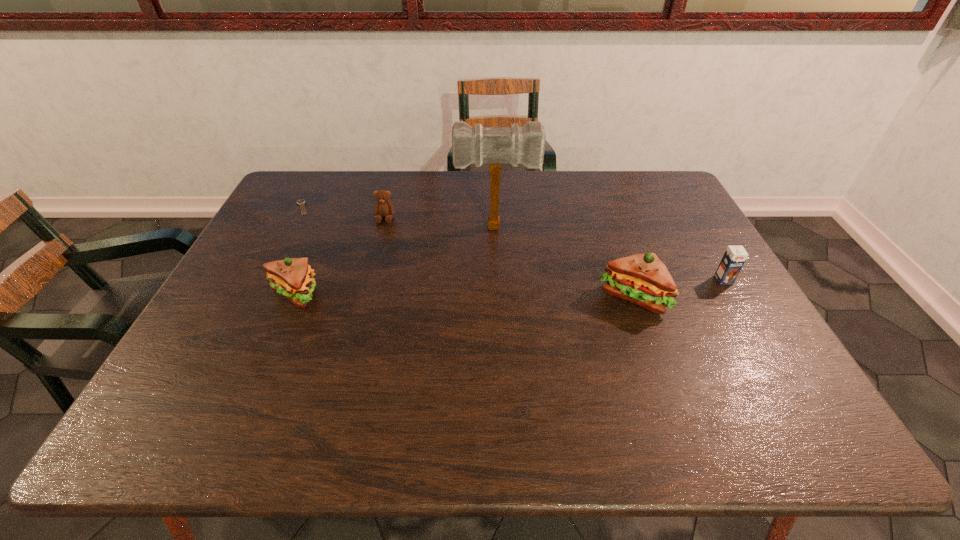
At what (x,y) coordinates should I click in order to perform the action: click on vacant space that is in between the mallet and the fifth shortest object. Please return your answer as a coordinate pair (x, y). Looking at the image, I should click on (564, 262).

Locate an element on the screen. This screenshot has width=960, height=540. empty space that is in between the left sandwich and the shortest object is located at coordinates (299, 251).

At what (x,y) coordinates should I click in order to perform the action: click on vacant area that lies between the taller sandwich and the left sandwich. Please return your answer as a coordinate pair (x, y). This screenshot has height=540, width=960. Looking at the image, I should click on (464, 296).

Where is `free spot between the taller sandwich and the teddy bear`? This screenshot has height=540, width=960. free spot between the taller sandwich and the teddy bear is located at coordinates (509, 258).

You are a GUI agent. You are given a task and a screenshot of the screen. Output one action in this format:
    pyautogui.click(x=<x>, y=<y>)
    Task: Click on the closest object relative to the watch
    The image size is (960, 540).
    Given the screenshot: What is the action you would take?
    pyautogui.click(x=383, y=208)

Identify which object is the fourth closest to the watch. Please provide its 2D coordinates. Your answer should be formatted as a tuple, i.e. [(x, y)], where the tuple contains the x and y coordinates of a point satisfying the conditions above.

[(642, 279)]